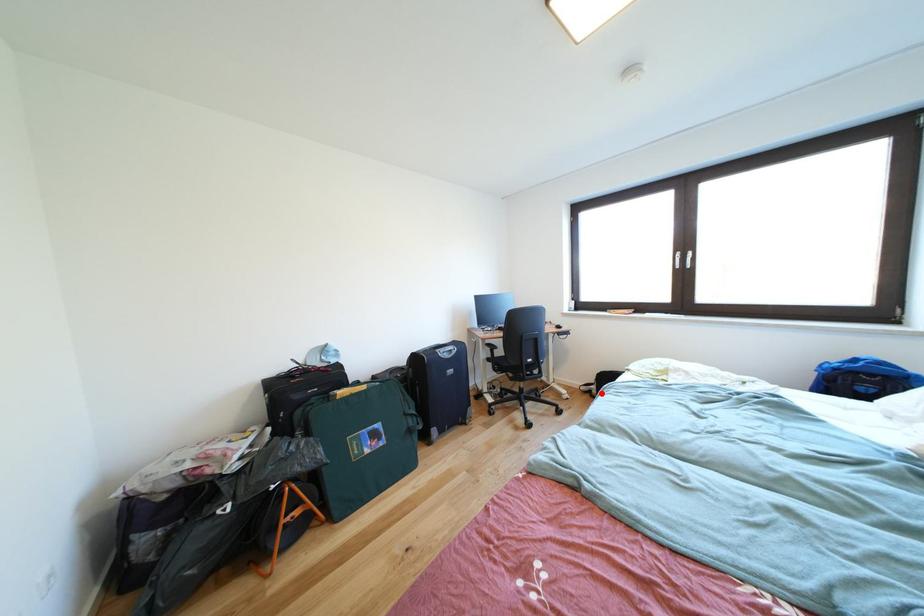
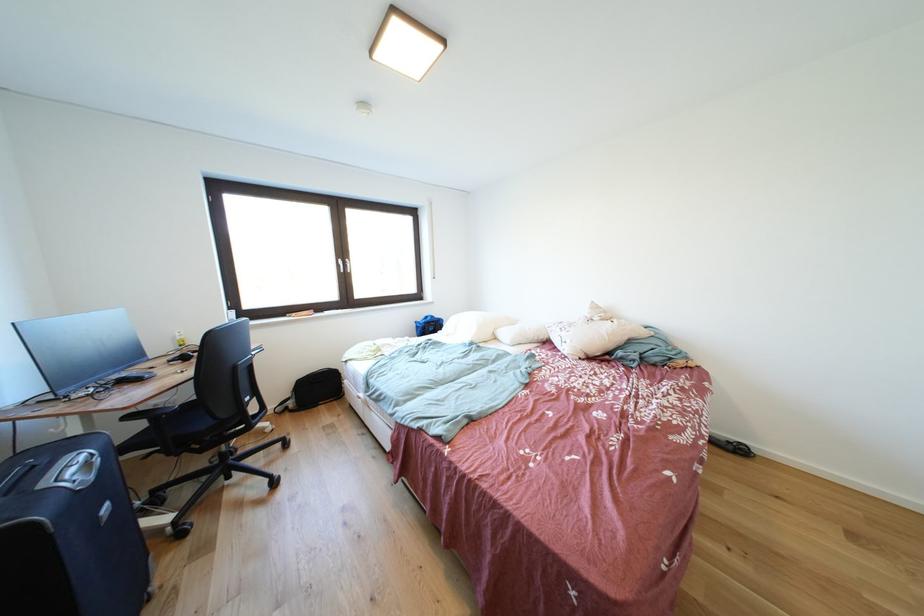
Question: A red point is marked in image1. In image2, is the corresponding 3D point closer to the camera or farther? Reply with the corresponding letter.

Choices:
 (A) The corresponding 3D point is closer.
 (B) The corresponding 3D point is farther.

Answer: (A)